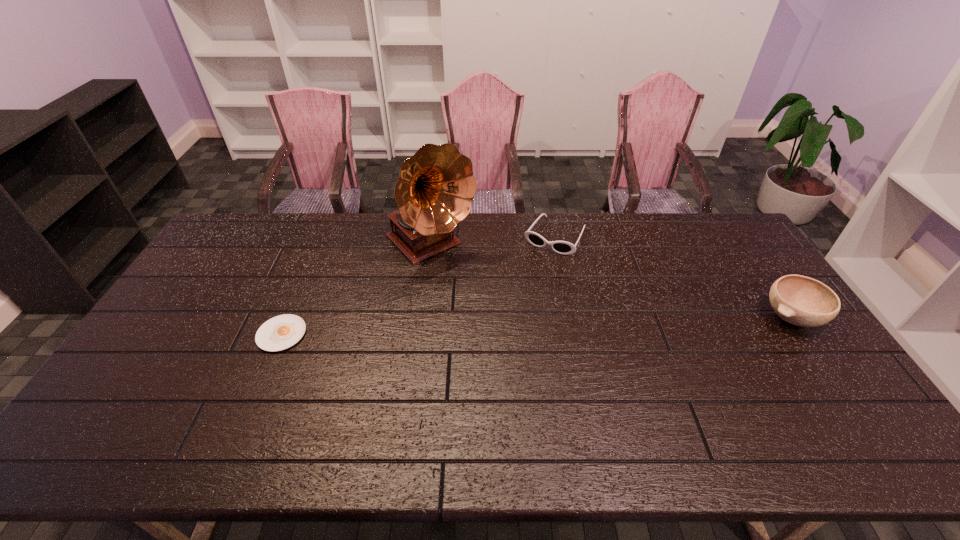
What are the coordinates of `vacant space on the desktop that is between the egg yolk and the bowl and is positioned with the lenses of the third object from left to right facing outward` in the screenshot? It's located at tap(498, 327).

At what (x,y) coordinates should I click in order to perform the action: click on free spot on the desktop that is between the shortest object and the bowl and is positioned on the horn of the tallest object. Please return your answer as a coordinate pair (x, y). Looking at the image, I should click on (514, 327).